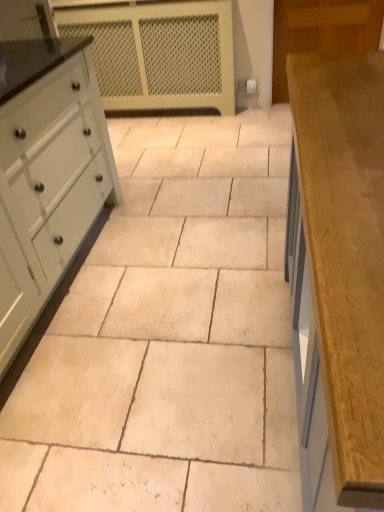
Based on the photo, measure the distance between wooden countertop at right and camera.

wooden countertop at right and camera are 33.68 centimeters apart.

Describe the element at coordinates (338, 275) in the screenshot. The height and width of the screenshot is (512, 384). I see `wooden countertop at right` at that location.

Identify the location of white painted wood chest of drawers at left. Image resolution: width=384 pixels, height=512 pixels. (49, 184).

Find the location of a particular element. white mesh radiator at upper center is located at coordinates (159, 53).

This screenshot has height=512, width=384. I want to click on wooden countertop at right, so click(338, 275).

Looking at the image, does white painted wood chest of drawers at left seem bigger or smaller compared to beige stone tile at center?

Clearly, white painted wood chest of drawers at left is larger in size than beige stone tile at center.

From a real-world perspective, relative to beige stone tile at center, is white painted wood chest of drawers at left vertically above or below?

white painted wood chest of drawers at left is situated higher than beige stone tile at center in the real world.

Between white painted wood chest of drawers at left and beige stone tile at center, which one has larger width?

beige stone tile at center is wider.

Considering the relative sizes of white mesh radiator at upper center and white painted wood chest of drawers at left in the image provided, is white mesh radiator at upper center shorter than white painted wood chest of drawers at left?

Incorrect, the height of white mesh radiator at upper center does not fall short of that of white painted wood chest of drawers at left.

From the image's perspective, between white mesh radiator at upper center and white painted wood chest of drawers at left, who is located below?

white painted wood chest of drawers at left, from the image's perspective.

Is white mesh radiator at upper center beside white painted wood chest of drawers at left?

No, white mesh radiator at upper center is not making contact with white painted wood chest of drawers at left.

Considering the sizes of objects beige stone tile at center and white mesh radiator at upper center in the image provided, who is thinner, beige stone tile at center or white mesh radiator at upper center?

white mesh radiator at upper center is thinner.

Is white mesh radiator at upper center a part of beige stone tile at center?

No, white mesh radiator at upper center is located outside of beige stone tile at center.

Which is behind, point (42, 430) or point (115, 17)?

Point (115, 17)

From the image's perspective, between wooden countertop at right and white painted wood chest of drawers at left, who is located below?

From the image's view, wooden countertop at right is below.

Could you tell me if wooden countertop at right is turned towards white painted wood chest of drawers at left?

No, wooden countertop at right is not aimed at white painted wood chest of drawers at left.

Is wooden countertop at right not near white painted wood chest of drawers at left?

Yes, wooden countertop at right and white painted wood chest of drawers at left are quite far apart.

Which object is more forward, wooden countertop at right or white painted wood chest of drawers at left?

wooden countertop at right is more forward.

Considering the sizes of white mesh radiator at upper center and wooden countertop at right in the image, is white mesh radiator at upper center bigger or smaller than wooden countertop at right?

Considering their sizes, white mesh radiator at upper center takes up less space than wooden countertop at right.

Considering the relative sizes of white mesh radiator at upper center and wooden countertop at right in the image provided, is white mesh radiator at upper center shorter than wooden countertop at right?

Correct, white mesh radiator at upper center is not as tall as wooden countertop at right.

Where is `countertop that is below the white mesh radiator at upper center (from the image's perspective)`? countertop that is below the white mesh radiator at upper center (from the image's perspective) is located at coordinates (338, 275).

Is white mesh radiator at upper center oriented towards wooden countertop at right?

Yes, white mesh radiator at upper center is oriented towards wooden countertop at right.

From a real-world perspective, is white mesh radiator at upper center positioned above or below beige stone tile at center?

white mesh radiator at upper center is situated higher than beige stone tile at center in the real world.

Where is `appliance above the beige stone tile at center (from a real-world perspective)`? appliance above the beige stone tile at center (from a real-world perspective) is located at coordinates (159, 53).

Is white mesh radiator at upper center turned away from beige stone tile at center?

No, white mesh radiator at upper center is not facing the opposite direction of beige stone tile at center.

Does beige stone tile at center come behind white painted wood chest of drawers at left?

No, beige stone tile at center is closer to the camera.

Measure the distance between beige stone tile at center and white painted wood chest of drawers at left.

The distance of beige stone tile at center from white painted wood chest of drawers at left is 19.75 inches.

From the picture: Which of these two, beige stone tile at center or white painted wood chest of drawers at left, stands taller?

white painted wood chest of drawers at left.

Can you confirm if beige stone tile at center is smaller than white painted wood chest of drawers at left?

Yes.

Locate an element on the screen. chest of drawers above the beige stone tile at center (from a real-world perspective) is located at coordinates (49, 184).

Where is `appliance that is behind the white painted wood chest of drawers at left`? This screenshot has height=512, width=384. appliance that is behind the white painted wood chest of drawers at left is located at coordinates (159, 53).

When comparing their distances from beige stone tile at center, does white mesh radiator at upper center or white painted wood chest of drawers at left seem closer?

Based on the image, white painted wood chest of drawers at left appears to be nearer to beige stone tile at center.

Looking at the image, which one is located closer to white mesh radiator at upper center, white painted wood chest of drawers at left or wooden countertop at right?

Based on the image, white painted wood chest of drawers at left appears to be nearer to white mesh radiator at upper center.

From the image, which object appears to be farther from beige stone tile at center, white painted wood chest of drawers at left or white mesh radiator at upper center?

Based on the image, white mesh radiator at upper center appears to be further to beige stone tile at center.

When comparing their distances from beige stone tile at center, does white mesh radiator at upper center or wooden countertop at right seem closer?

The object closer to beige stone tile at center is wooden countertop at right.

Based on their spatial positions, is beige stone tile at center or white mesh radiator at upper center further from white painted wood chest of drawers at left?

white mesh radiator at upper center is positioned further to the anchor white painted wood chest of drawers at left.

When comparing their distances from white painted wood chest of drawers at left, does wooden countertop at right or beige stone tile at center seem further?

wooden countertop at right.

From the image, which object appears to be nearer to white mesh radiator at upper center, beige stone tile at center or white painted wood chest of drawers at left?

Among the two, beige stone tile at center is located nearer to white mesh radiator at upper center.

In the scene shown: Estimate the real-world distances between objects in this image. Which object is further from white mesh radiator at upper center, wooden countertop at right or beige stone tile at center?

wooden countertop at right lies further to white mesh radiator at upper center than the other object.

Where is `ceramic tile between wooden countertop at right and white mesh radiator at upper center along the z-axis`? ceramic tile between wooden countertop at right and white mesh radiator at upper center along the z-axis is located at coordinates (170, 336).

You are a GUI agent. You are given a task and a screenshot of the screen. Output one action in this format:
    pyautogui.click(x=<x>, y=<y>)
    Task: Click on the chest of drawers between wooden countertop at right and white mesh radiator at upper center from front to back
    The image size is (384, 512).
    Given the screenshot: What is the action you would take?
    pyautogui.click(x=49, y=184)

At what (x,y) coordinates should I click in order to perform the action: click on chest of drawers between beige stone tile at center and white mesh radiator at upper center from front to back. Please return your answer as a coordinate pair (x, y). The width and height of the screenshot is (384, 512). Looking at the image, I should click on (49, 184).

The image size is (384, 512). I want to click on ceramic tile between white painted wood chest of drawers at left and wooden countertop at right, so click(x=170, y=336).